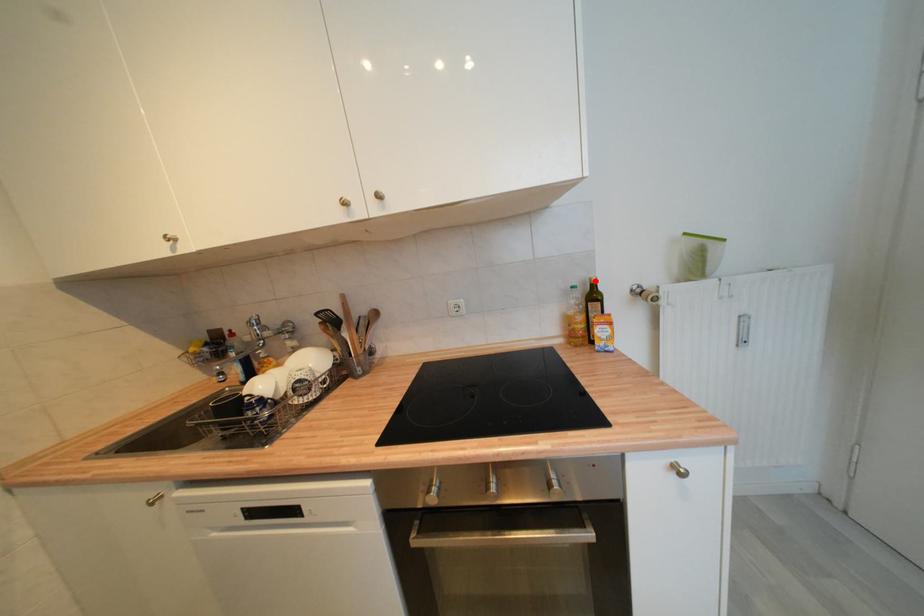
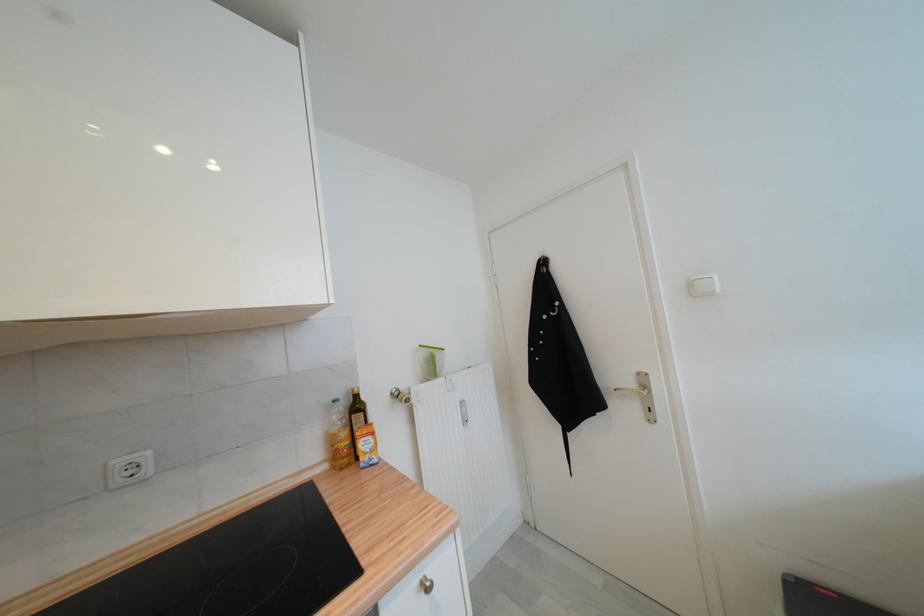
Locate, in the second image, the point that corresponds to the highlighted location in the first image.

(358, 392)